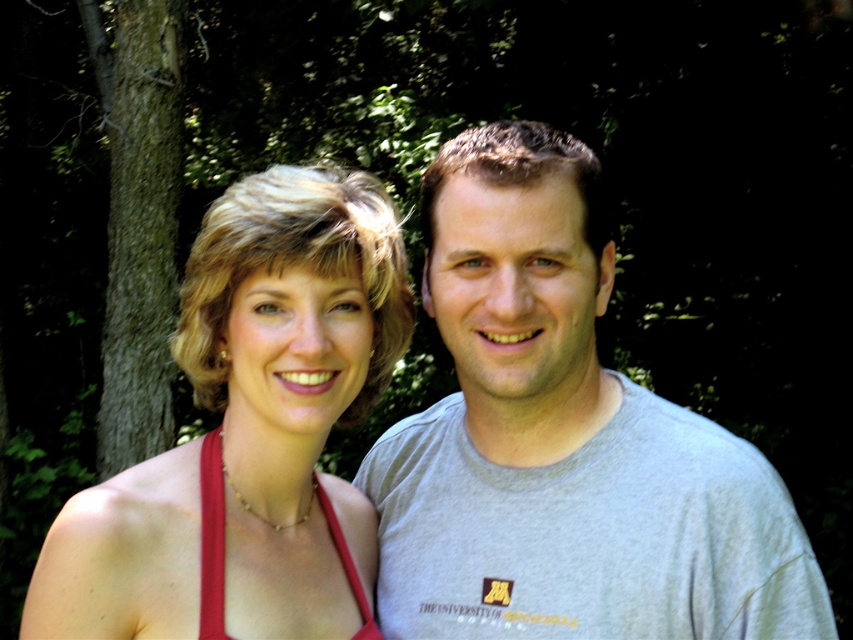
Is gray cotton t-shirt at center taller than matte red dress at center?

Correct, gray cotton t-shirt at center is much taller as matte red dress at center.

Describe the element at coordinates (563, 440) in the screenshot. I see `gray cotton t-shirt at center` at that location.

Between point (573, 452) and point (230, 214), which one is positioned behind?

Positioned behind is point (573, 452).

I want to click on gray cotton t-shirt at center, so click(563, 440).